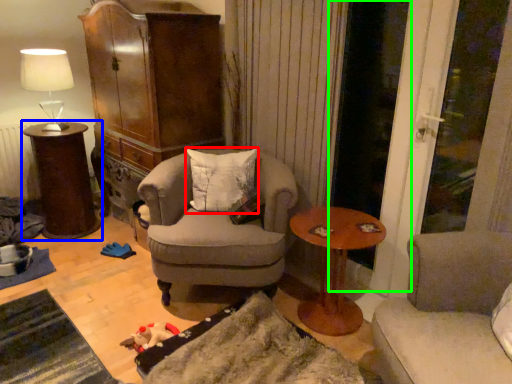
Question: Considering the real-world distances, which object is farthest from pillow (highlighted by a red box)? table (highlighted by a blue box) or screen door (highlighted by a green box)?

Choices:
 (A) table
 (B) screen door

Answer: (A)